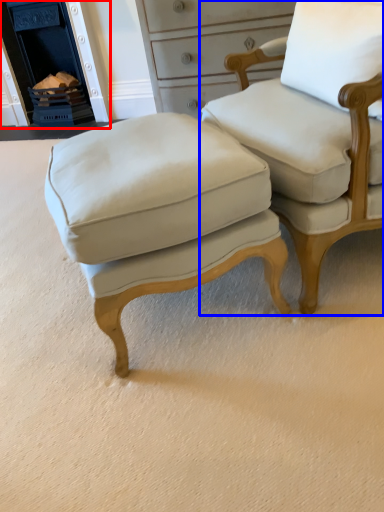
Question: Among these objects, which one is farthest to the camera, fireplace (highlighted by a red box) or chair (highlighted by a blue box)?

Choices:
 (A) fireplace
 (B) chair

Answer: (A)